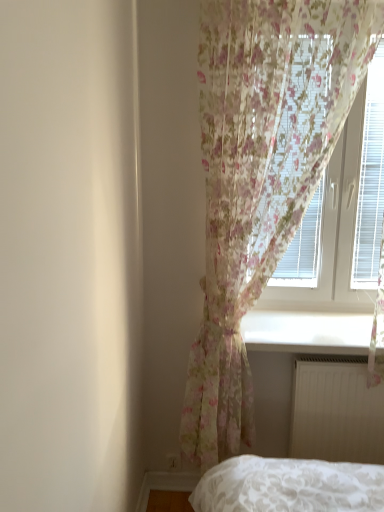
Identify the location of white smooth window sill at lower center. The width and height of the screenshot is (384, 512). (307, 332).

Identify the location of translucent floral curtain at upper right. (328, 234).

Where is `white smooth window sill at lower center`? Image resolution: width=384 pixels, height=512 pixels. white smooth window sill at lower center is located at coordinates (307, 332).

Do you think white smooth window sill at lower center is within floral sheer curtain at upper right, or outside of it?

The correct answer is: outside.

The width and height of the screenshot is (384, 512). I want to click on window sill below the floral sheer curtain at upper right (from the image's perspective), so [307, 332].

Considering the relative sizes of white smooth window sill at lower center and floral sheer curtain at upper right in the image provided, is white smooth window sill at lower center shorter than floral sheer curtain at upper right?

Indeed, white smooth window sill at lower center has a lesser height compared to floral sheer curtain at upper right.

Considering the sizes of objects white smooth window sill at lower center and floral sheer curtain at upper right in the image provided, who is wider, white smooth window sill at lower center or floral sheer curtain at upper right?

Wider between the two is white smooth window sill at lower center.

Is there a large distance between white matte radiator at lower right and floral sheer curtain at upper right?

That's not correct — white matte radiator at lower right is a little close to floral sheer curtain at upper right.

In the image, there is a floral sheer curtain at upper right. Identify the location of radiator below it (from the image's perspective). (336, 413).

Considering the positions of point (329, 368) and point (297, 56), is point (329, 368) closer or farther from the camera than point (297, 56)?

Point (329, 368) is positioned farther from the camera compared to point (297, 56).

How different are the orientations of white matte radiator at lower right and floral sheer curtain at upper right in degrees?

The angle between the facing direction of white matte radiator at lower right and the facing direction of floral sheer curtain at upper right is 0.0623 degrees.

Find the location of `window behind the white smooth window sill at lower center`. window behind the white smooth window sill at lower center is located at coordinates (328, 234).

Does white smooth window sill at lower center lie in front of translucent floral curtain at upper right?

Yes, white smooth window sill at lower center is closer to the viewer.

Considering the positions of points (316, 349) and (336, 308), is point (316, 349) closer to camera compared to point (336, 308)?

Yes, point (316, 349) is in front of point (336, 308).

Can you confirm if white smooth window sill at lower center is positioned to the right of translucent floral curtain at upper right?

No.

Who is taller, floral sheer curtain at upper right or white matte radiator at lower right?

floral sheer curtain at upper right is taller.

I want to click on radiator behind the floral sheer curtain at upper right, so click(336, 413).

Is floral sheer curtain at upper right positioned beyond the bounds of white matte radiator at lower right?

Yes, floral sheer curtain at upper right is located beyond the bounds of white matte radiator at lower right.

Does floral sheer curtain at upper right appear on the right side of white matte radiator at lower right?

In fact, floral sheer curtain at upper right is to the left of white matte radiator at lower right.

How much distance is there between floral sheer curtain at upper right and translucent floral curtain at upper right?

floral sheer curtain at upper right is 20.15 inches away from translucent floral curtain at upper right.

Between point (273, 234) and point (302, 241), which one is positioned behind?

Point (302, 241)

Is floral sheer curtain at upper right turned away from translucent floral curtain at upper right?

Correct, floral sheer curtain at upper right is looking away from translucent floral curtain at upper right.

From a real-world perspective, is floral sheer curtain at upper right positioned under white smooth window sill at lower center based on gravity?

No, from a real-world perspective, floral sheer curtain at upper right is not below white smooth window sill at lower center.

Do you think floral sheer curtain at upper right is within white smooth window sill at lower center, or outside of it?

floral sheer curtain at upper right is not enclosed by white smooth window sill at lower center.

How different are the orientations of floral sheer curtain at upper right and white smooth window sill at lower center in degrees?

0.795 degrees.

Who is shorter, floral sheer curtain at upper right or white smooth window sill at lower center?

white smooth window sill at lower center.

Is white matte radiator at lower right positioned with its back to white smooth window sill at lower center?

No.

Can you confirm if white matte radiator at lower right is shorter than white smooth window sill at lower center?

Incorrect, the height of white matte radiator at lower right does not fall short of that of white smooth window sill at lower center.

What are the coordinates of `curtain above the white smooth window sill at lower center (from the image's perspective)` in the screenshot? It's located at (261, 175).

Identify the location of curtain above the white matte radiator at lower right (from a real-world perspective). Image resolution: width=384 pixels, height=512 pixels. coord(261,175).

Based on their spatial positions, is white smooth window sill at lower center or white matte radiator at lower right closer to translucent floral curtain at upper right?

white smooth window sill at lower center.

Looking at the image, which one is located closer to white matte radiator at lower right, floral sheer curtain at upper right or white smooth window sill at lower center?

Among the two, white smooth window sill at lower center is located nearer to white matte radiator at lower right.

From the image, which object appears to be nearer to floral sheer curtain at upper right, white matte radiator at lower right or white smooth window sill at lower center?

Based on the image, white smooth window sill at lower center appears to be nearer to floral sheer curtain at upper right.

Based on their spatial positions, is white smooth window sill at lower center or translucent floral curtain at upper right further from floral sheer curtain at upper right?

white smooth window sill at lower center lies further to floral sheer curtain at upper right than the other object.

Looking at the image, which one is located closer to translucent floral curtain at upper right, white matte radiator at lower right or white smooth window sill at lower center?

white smooth window sill at lower center.

When comparing their distances from white smooth window sill at lower center, does translucent floral curtain at upper right or white matte radiator at lower right seem closer?

Among the two, white matte radiator at lower right is located nearer to white smooth window sill at lower center.

When comparing their distances from white matte radiator at lower right, does floral sheer curtain at upper right or translucent floral curtain at upper right seem further?

floral sheer curtain at upper right lies further to white matte radiator at lower right than the other object.

When comparing their distances from white smooth window sill at lower center, does floral sheer curtain at upper right or white matte radiator at lower right seem further?

A: The object further to white smooth window sill at lower center is floral sheer curtain at upper right.

Image resolution: width=384 pixels, height=512 pixels. In order to click on window sill between floral sheer curtain at upper right and white matte radiator at lower right from top to bottom in this screenshot , I will do `click(307, 332)`.

Image resolution: width=384 pixels, height=512 pixels. I want to click on curtain between translucent floral curtain at upper right and white smooth window sill at lower center in the vertical direction, so click(261, 175).

The image size is (384, 512). What are the coordinates of `curtain between translucent floral curtain at upper right and white matte radiator at lower right vertically` in the screenshot? It's located at (261, 175).

Locate an element on the screen. window sill between translucent floral curtain at upper right and white matte radiator at lower right in the up-down direction is located at coordinates (307, 332).